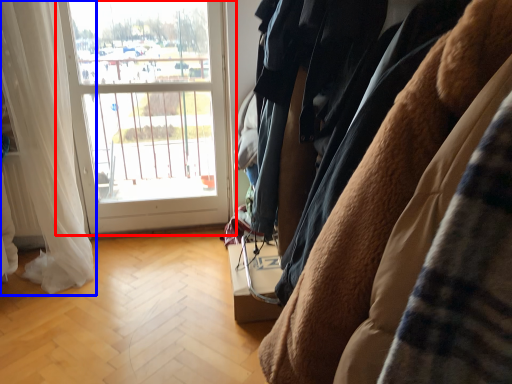
Question: Which of the following is the closest to the observer, window (highlighted by a red box) or curtain (highlighted by a blue box)?

Choices:
 (A) window
 (B) curtain

Answer: (B)